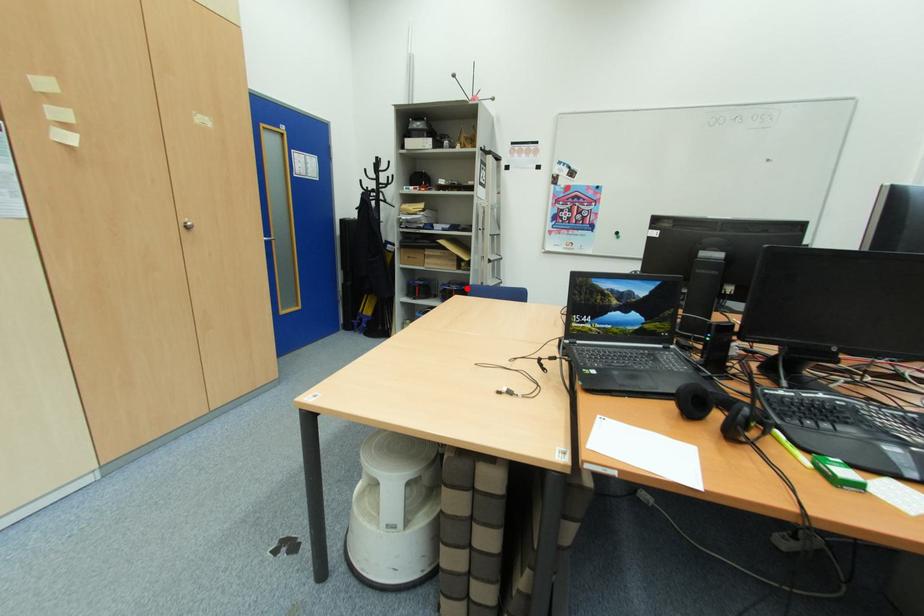
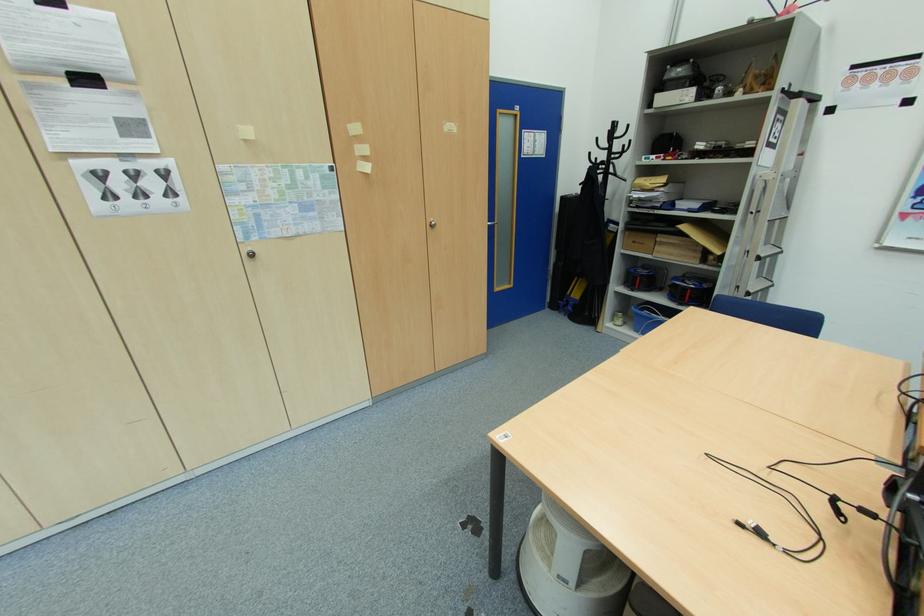
Question: I am providing you with two images of the same scene from different viewpoints. Given a red point in image1, look at the same physical point in image2. Is it:

Choices:
 (A) Closer to the viewpoint
 (B) Farther from the viewpoint

Answer: (A)